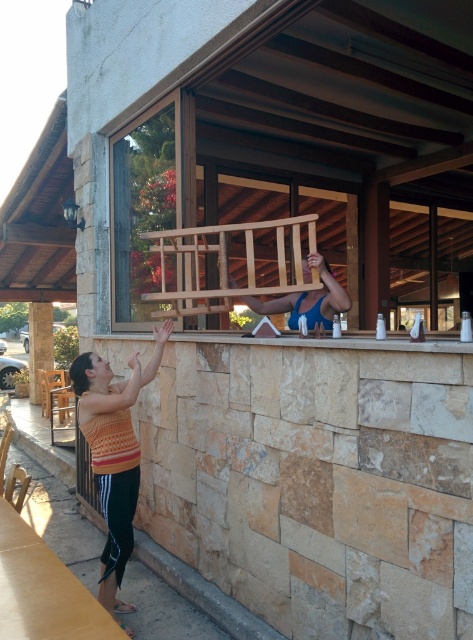
You are standing at the point with coordinates point (36, 365) and want to walk to the point (283, 300). According to the scene description, which direction should you move to reach your destination?

To move from point (36, 365) to point (283, 300), you should move upwards because point (283, 300) is in front of point (36, 365).

You are a customer trying to find a place to sit. You see the wooden rail at center and the brown stone pillar at lower left. Which object is bigger in size?

The wooden rail at center has a larger size compared to the brown stone pillar at lower left, so the wooden rail at center is bigger.